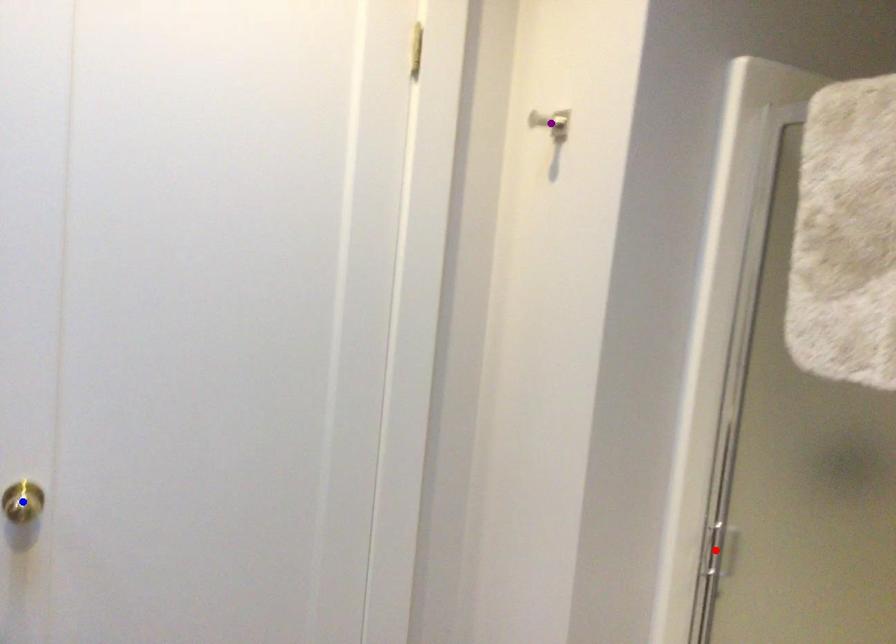
Order these from nearest to farthest:
purple point | red point | blue point

blue point < red point < purple point